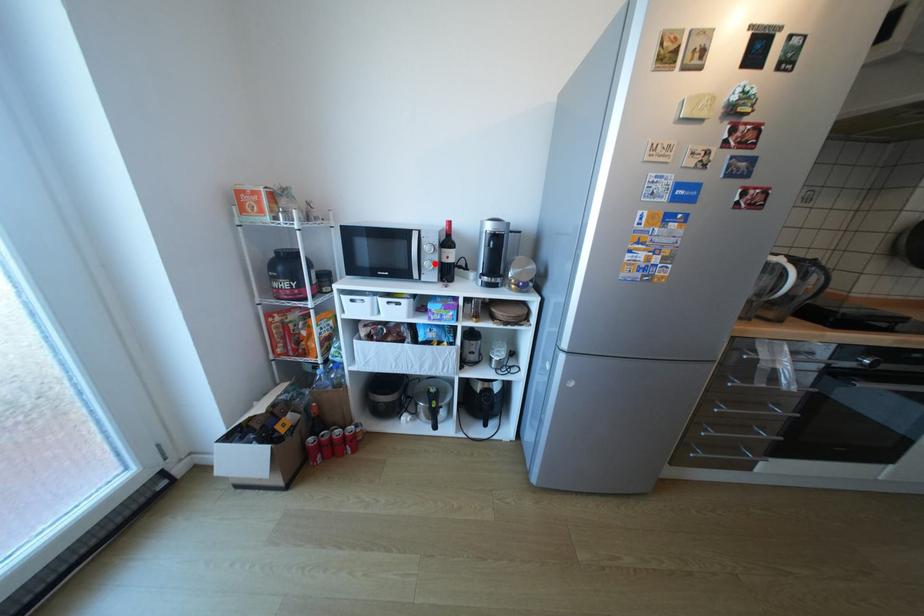
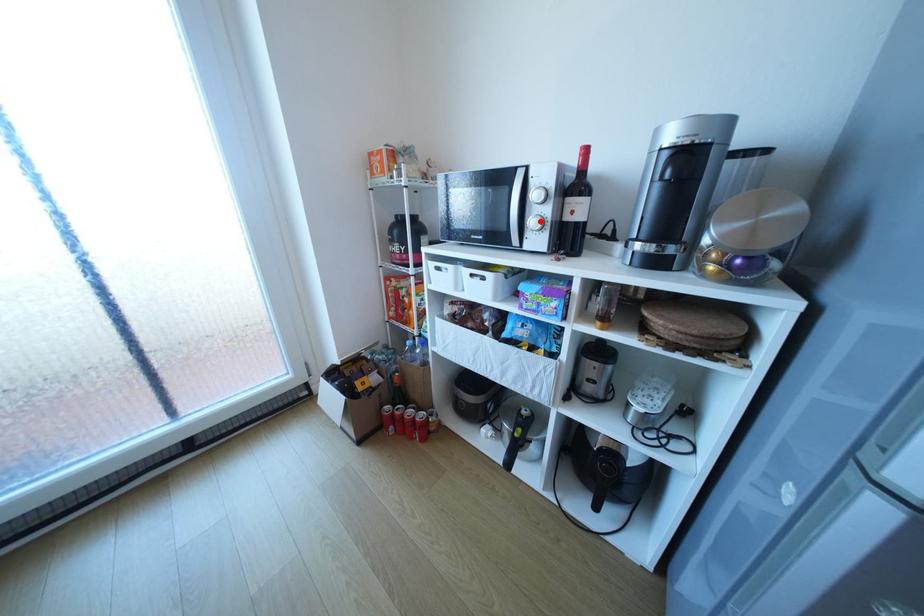
I am providing you with two images of the same scene from different viewpoints. A red point is marked on the first image and another point is marked on the second image. Does the point marked in image1 correspond to the same location as the one in image2?

Yes